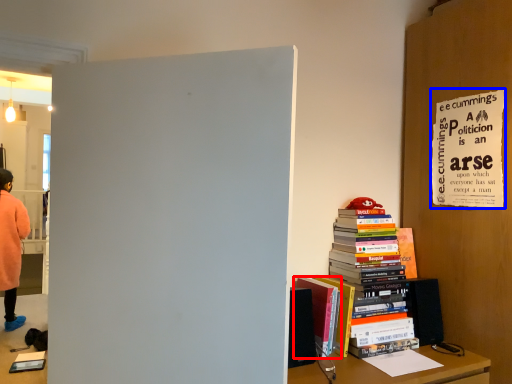
Question: Which object appears closest to the camera in this image, book (highlighted by a red box) or poster page (highlighted by a blue box)?

Choices:
 (A) book
 (B) poster page

Answer: (B)